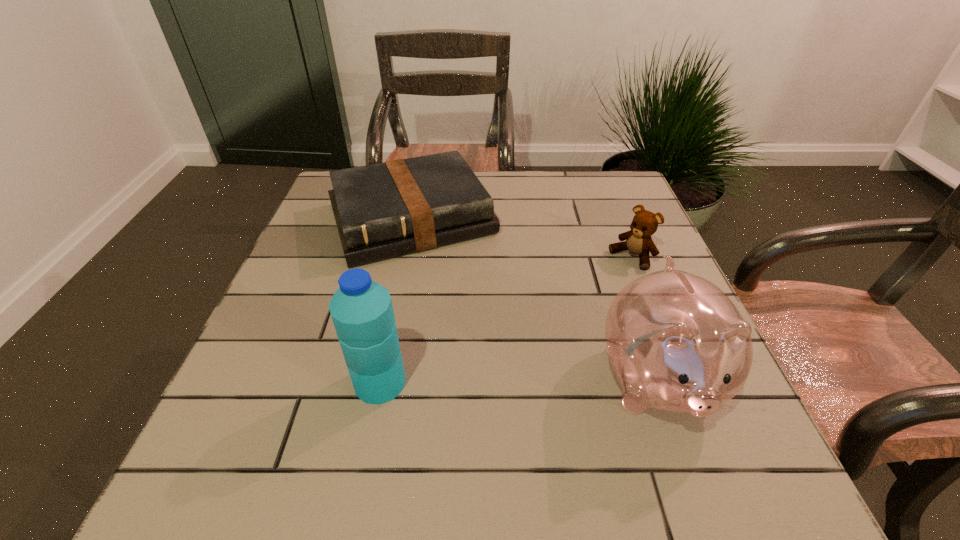
Where is `free space on the desktop that is between the water bottle and the piggy bank and is positioned on the front-facing side of the teddy bear`? This screenshot has width=960, height=540. free space on the desktop that is between the water bottle and the piggy bank and is positioned on the front-facing side of the teddy bear is located at coordinates (478, 382).

Identify the location of free space on the desktop that is between the water bottle and the piggy bank and is positioned on the spine side of the shortest object. (491, 382).